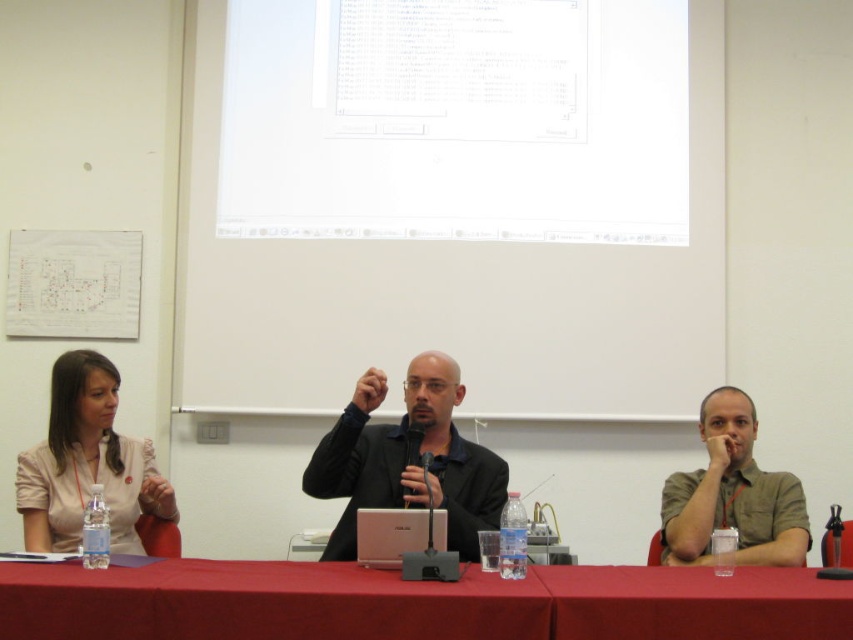
You are a photographer in the back of the room. You need to take a photo of the speaker wearing the green cotton shirt at center and the black plastic microphone at center. Which object should you focus on first if you want to ensure both are in focus?

The green cotton shirt at center is located below the black plastic microphone at center. Since the microphone is higher up, you should focus on the microphone first to ensure both are in focus.

You are standing at the camera position and want to throw a ball to the point marked as point (x=343, y=540). What is the minimum distance you need to throw the ball?

The minimum distance you need to throw the ball is 2.45 meters, as the point (x=343, y=540) is 2.45 meters away from the camera.